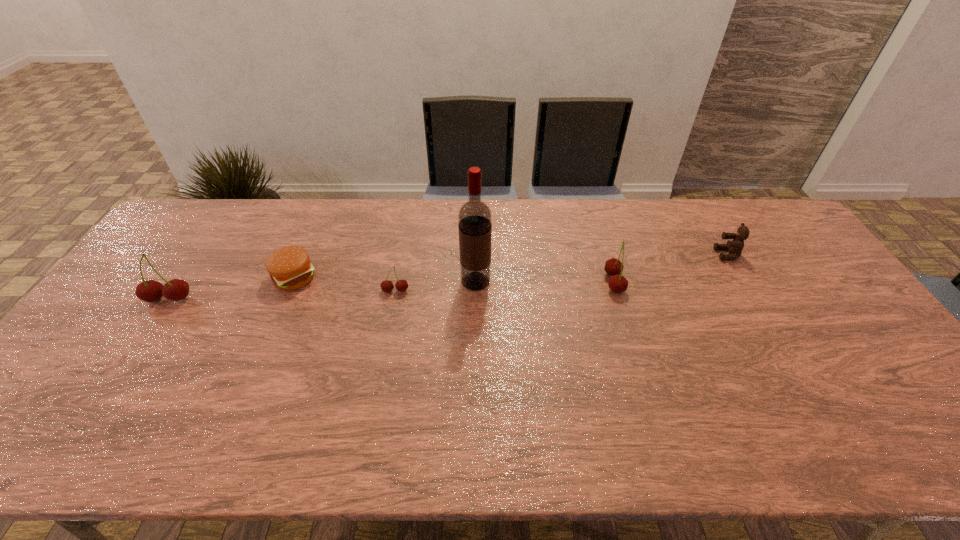
At what (x,y) coordinates should I click in order to perform the action: click on blank space located on the surface of the third object from left to right. Please return your answer as a coordinate pair (x, y). This screenshot has height=540, width=960. Looking at the image, I should click on click(390, 322).

Find the location of `free space located on the surface of the fifth object from left to right`. free space located on the surface of the fifth object from left to right is located at coordinates (657, 283).

The width and height of the screenshot is (960, 540). I want to click on vacant space positioned 0.120m on the face of the teddy bear, so click(x=679, y=254).

What are the coordinates of `free space located on the face of the teddy bear` in the screenshot? It's located at (647, 254).

At what (x,y) coordinates should I click in order to perform the action: click on vacant space situated 0.230m on the face of the teddy bear. Please return your answer as a coordinate pair (x, y). Looking at the image, I should click on (644, 254).

This screenshot has height=540, width=960. What are the coordinates of `free space located on the front of the tallest object` in the screenshot? It's located at (475, 358).

At what (x,y) coordinates should I click in order to perform the action: click on blank space located 0.130m on the back of the fifth object from right to left. Please return your answer as a coordinate pair (x, y). The width and height of the screenshot is (960, 540). Looking at the image, I should click on (312, 234).

Locate an element on the screen. object that is at the left edge is located at coordinates (176, 289).

This screenshot has width=960, height=540. In the image, there is a desktop. Find the location of `vacant space at the far edge`. vacant space at the far edge is located at coordinates (329, 230).

I want to click on free spot at the left edge of the desktop, so click(x=120, y=301).